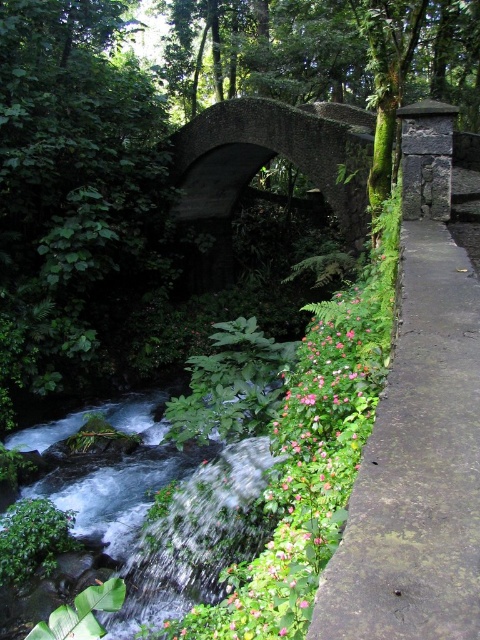
Question: Does pink matte flowers at center appear on the left side of clear water at bottom left?

Choices:
 (A) no
 (B) yes

Answer: (A)

Question: Which object appears closest to the camera in this image?

Choices:
 (A) pink matte flowers at center
 (B) clear water at bottom left

Answer: (A)

Question: Which point is closer to the camera?

Choices:
 (A) (36, 428)
 (B) (420, 266)

Answer: (B)

Question: Is pink matte flowers at center to the left of dark gray stone bridge at center from the viewer's perspective?

Choices:
 (A) no
 (B) yes

Answer: (B)

Question: Is green mossy concrete pavement at right closer to camera compared to clear water at bottom left?

Choices:
 (A) yes
 (B) no

Answer: (A)

Question: Which object is closer to the camera taking this photo?

Choices:
 (A) green mossy concrete pavement at right
 (B) dark gray stone bridge at center

Answer: (A)